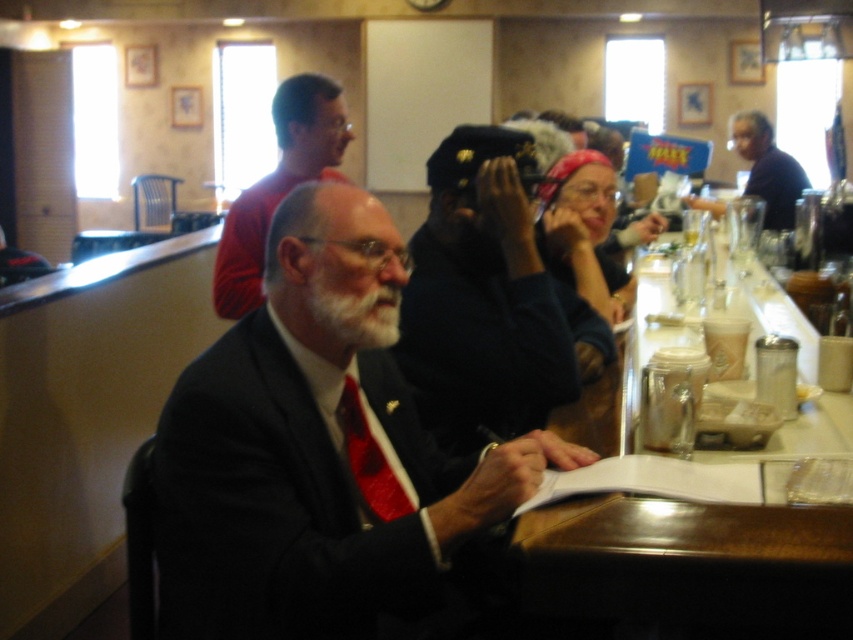
You are standing at the bar and want to reach both the point at coordinates (x=444, y=536) and the point at (x=759, y=148). Which point should you approach first to reach the closer one?

The point at coordinates (x=444, y=536) is closer to the viewer than the point at (x=759, y=148), so you should approach the point at (x=444, y=536) first.

You are a photographer at the event and need to capture both the matte black suit at center and the dark blue shirt at right in a single frame. Which subject should you position closer to the camera to ensure both are fully visible?

The matte black suit at center is shorter than the dark blue shirt at right. To ensure both are fully visible in the frame, position the matte black suit at center closer to the camera since it is shorter and requires less vertical space compared to the taller dark blue shirt at right.